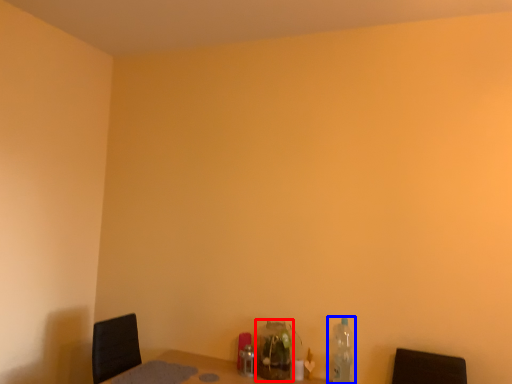
Question: Which object appears closest to the camera in this image, bottle (highlighted by a red box) or bottle (highlighted by a blue box)?

Choices:
 (A) bottle
 (B) bottle

Answer: (B)